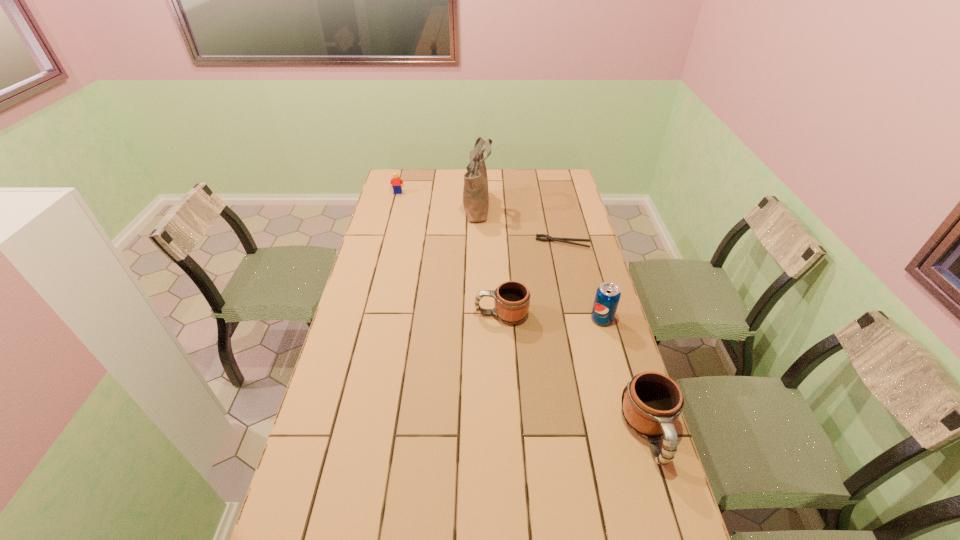
Locate an element on the screen. empty space between the shoulder bag and the third farthest object is located at coordinates (520, 225).

The image size is (960, 540). What are the coordinates of `blank region between the tongs and the shorter mug` in the screenshot? It's located at (533, 279).

Locate an element on the screen. The image size is (960, 540). vacant point located between the pop soda and the leftmost object is located at coordinates (500, 256).

Where is `vacant region between the shoulder bag and the shortest object`? Image resolution: width=960 pixels, height=540 pixels. vacant region between the shoulder bag and the shortest object is located at coordinates (520, 225).

Where is `vacant area between the tallest object and the leftmost object`? vacant area between the tallest object and the leftmost object is located at coordinates (438, 199).

The width and height of the screenshot is (960, 540). Find the location of `empty space that is in between the shortest object and the taller mug`. empty space that is in between the shortest object and the taller mug is located at coordinates (606, 338).

The image size is (960, 540). Find the location of `free area in between the pop soda and the tallest object`. free area in between the pop soda and the tallest object is located at coordinates (540, 262).

Identify which object is the fourth nearest to the taller mug. Please provide its 2D coordinates. Your answer should be formatted as a tuple, i.e. [(x, y)], where the tuple contains the x and y coordinates of a point satisfying the conditions above.

[(475, 192)]

Locate an element on the screen. object that is the third closest to the shoulder bag is located at coordinates (511, 299).

The image size is (960, 540). I want to click on vacant area that satisfies the following two spatial constraints: 1. on the front-facing side of the tallest object; 2. on the back side of the pop soda, so click(477, 319).